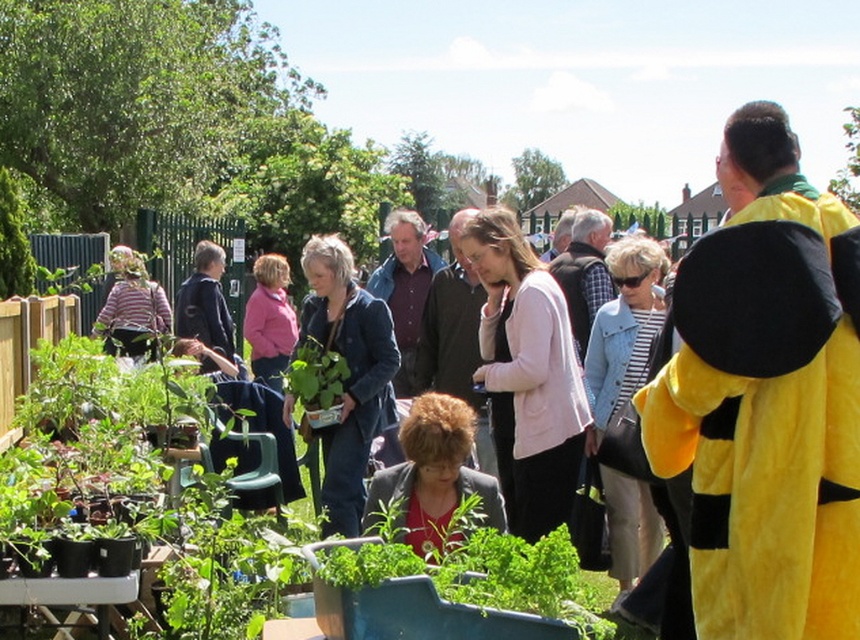
You are at the community garden event and notice two jackets hanging on a rack. The jackets are labeled as the matte blue jacket at center and the matte black jacket at center. Which jacket is positioned higher on the rack?

The matte blue jacket at center is located above the matte black jacket at center, so it is positioned higher on the rack.